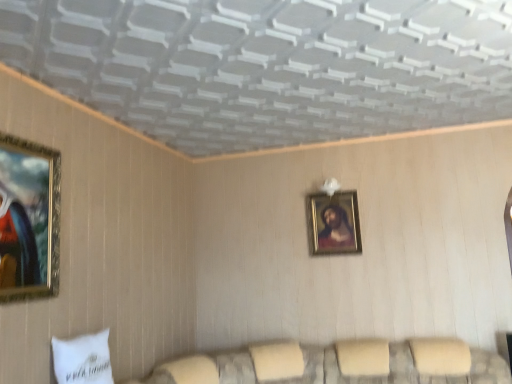
What do you see at coordinates (82, 359) in the screenshot? Image resolution: width=512 pixels, height=384 pixels. I see `white fabric pillow at lower left` at bounding box center [82, 359].

This screenshot has width=512, height=384. What do you see at coordinates (29, 219) in the screenshot?
I see `gold-framed painting at left, which appears as the 2th picture frame when viewed from the right` at bounding box center [29, 219].

At what (x,y) coordinates should I click in order to perform the action: click on white fabric pillow at lower left. Please return your answer as a coordinate pair (x, y). Looking at the image, I should click on (82, 359).

Is white fabric pillow at lower left surrounded by gold-framed portrait at center, which ranks as the second picture frame in left-to-right order?

No, white fabric pillow at lower left is not a part of gold-framed portrait at center, which ranks as the second picture frame in left-to-right order.

Considering the relative sizes of gold-framed portrait at center, the first picture frame in the back-to-front sequence, and white fabric pillow at lower left in the image provided, is gold-framed portrait at center, the first picture frame in the back-to-front sequence, bigger than white fabric pillow at lower left?

Incorrect, gold-framed portrait at center, the first picture frame in the back-to-front sequence, is not larger than white fabric pillow at lower left.

Which object is closer to the camera, gold-framed portrait at center, the first picture frame when ordered from right to left, or white fabric pillow at lower left?

white fabric pillow at lower left is more forward.

Which object is further away from the camera taking this photo, gold-framed portrait at center, the first picture frame in the back-to-front sequence, or gold-framed painting at left, arranged as the 1th picture frame when viewed from the front?

Positioned behind is gold-framed portrait at center, the first picture frame in the back-to-front sequence.

Does gold-framed portrait at center, the first picture frame in the back-to-front sequence, turn towards gold-framed painting at left, arranged as the 1th picture frame when viewed from the front?

No.

Who is taller, gold-framed portrait at center, the first picture frame in the back-to-front sequence, or gold-framed painting at left, the 2th picture frame positioned from the back?

Standing taller between the two is gold-framed painting at left, the 2th picture frame positioned from the back.

Is gold-framed painting at left, the 1th picture frame when ordered from left to right, facing away from velvet beige couch at lower center?

No, gold-framed painting at left, the 1th picture frame when ordered from left to right,'s orientation is not away from velvet beige couch at lower center.

What are the coordinates of `picture frame on the left of velvet beige couch at lower center` in the screenshot? It's located at (29, 219).

Does point (7, 239) come closer to viewer compared to point (508, 371)?

Yes.

From their relative heights in the image, would you say gold-framed painting at left, the 1th picture frame when ordered from left to right, is taller or shorter than velvet beige couch at lower center?

Considering their sizes, gold-framed painting at left, the 1th picture frame when ordered from left to right, has more height than velvet beige couch at lower center.

From the image's perspective, which is below, gold-framed portrait at center, marked as the 2th picture frame in a front-to-back arrangement, or velvet beige couch at lower center?

From the image's view, velvet beige couch at lower center is below.

From a real-world perspective, is gold-framed portrait at center, which ranks as the second picture frame in left-to-right order, on top of velvet beige couch at lower center?

Yes.

You are a GUI agent. You are given a task and a screenshot of the screen. Output one action in this format:
    pyautogui.click(x=<x>, y=<y>)
    Task: Click on the couch in front of the gold-framed portrait at center, the first picture frame when ordered from right to left
    The image size is (512, 384).
    Given the screenshot: What is the action you would take?
    pyautogui.click(x=343, y=364)

Is gold-framed portrait at center, which ranks as the second picture frame in left-to-right order, in contact with velvet beige couch at lower center?

No.

Can you confirm if white fabric pillow at lower left is positioned to the right of gold-framed portrait at center, the first picture frame in the back-to-front sequence?

No.

Consider the image. From a real-world perspective, does white fabric pillow at lower left sit lower than gold-framed portrait at center, the first picture frame in the back-to-front sequence?

Yes, from a real-world perspective, white fabric pillow at lower left is under gold-framed portrait at center, the first picture frame in the back-to-front sequence.

Considering the sizes of objects white fabric pillow at lower left and gold-framed portrait at center, which ranks as the second picture frame in left-to-right order, in the image provided, who is bigger, white fabric pillow at lower left or gold-framed portrait at center, which ranks as the second picture frame in left-to-right order,?

Bigger between the two is white fabric pillow at lower left.

From the picture: Is white fabric pillow at lower left facing towards gold-framed portrait at center, which ranks as the second picture frame in left-to-right order?

No, white fabric pillow at lower left does not turn towards gold-framed portrait at center, which ranks as the second picture frame in left-to-right order.

Is white fabric pillow at lower left thinner than velvet beige couch at lower center?

Yes, white fabric pillow at lower left is thinner than velvet beige couch at lower center.

Is white fabric pillow at lower left positioned in front of velvet beige couch at lower center?

Yes.

Does white fabric pillow at lower left appear on the left side of velvet beige couch at lower center?

Correct, you'll find white fabric pillow at lower left to the left of velvet beige couch at lower center.

From the image's perspective, between white fabric pillow at lower left and velvet beige couch at lower center, who is located below?

From the image's view, velvet beige couch at lower center is below.

Would you say velvet beige couch at lower center is to the left or to the right of white fabric pillow at lower left in the picture?

velvet beige couch at lower center is positioned on white fabric pillow at lower left's right side.

Considering the sizes of velvet beige couch at lower center and white fabric pillow at lower left in the image, is velvet beige couch at lower center wider or thinner than white fabric pillow at lower left?

Clearly, velvet beige couch at lower center has more width compared to white fabric pillow at lower left.

From the image's perspective, is velvet beige couch at lower center beneath white fabric pillow at lower left?

Correct, velvet beige couch at lower center appears lower than white fabric pillow at lower left in the image.

Choose the correct answer: Is velvet beige couch at lower center inside white fabric pillow at lower left or outside it?

velvet beige couch at lower center exists outside the volume of white fabric pillow at lower left.

This screenshot has height=384, width=512. I want to click on the 1st picture frame above the white fabric pillow at lower left (from the image's perspective), so click(x=334, y=223).

This screenshot has height=384, width=512. In order to click on picture frame that is above the gold-framed painting at left, the 2th picture frame positioned from the back (from a real-world perspective) in this screenshot , I will do `click(334, 223)`.

Looking at the image, which one is located further to velvet beige couch at lower center, gold-framed portrait at center, which ranks as the second picture frame in left-to-right order, or gold-framed painting at left, the 2th picture frame positioned from the back?

Among the two, gold-framed painting at left, the 2th picture frame positioned from the back, is located further to velvet beige couch at lower center.

When comparing their distances from gold-framed portrait at center, the first picture frame when ordered from right to left, does velvet beige couch at lower center or gold-framed painting at left, the 1th picture frame when ordered from left to right, seem further?

Among the two, gold-framed painting at left, the 1th picture frame when ordered from left to right, is located further to gold-framed portrait at center, the first picture frame when ordered from right to left.

Looking at the image, which one is located further to white fabric pillow at lower left, gold-framed painting at left, the 2th picture frame positioned from the back, or gold-framed portrait at center, the first picture frame when ordered from right to left?

The object further to white fabric pillow at lower left is gold-framed portrait at center, the first picture frame when ordered from right to left.

When comparing their distances from gold-framed painting at left, which appears as the 2th picture frame when viewed from the right, does velvet beige couch at lower center or white fabric pillow at lower left seem closer?

Among the two, white fabric pillow at lower left is located nearer to gold-framed painting at left, which appears as the 2th picture frame when viewed from the right.

Looking at the image, which one is located further to gold-framed portrait at center, the first picture frame in the back-to-front sequence, velvet beige couch at lower center or white fabric pillow at lower left?

white fabric pillow at lower left.

Looking at the image, which one is located closer to gold-framed painting at left, arranged as the 1th picture frame when viewed from the front, gold-framed portrait at center, the first picture frame in the back-to-front sequence, or white fabric pillow at lower left?

white fabric pillow at lower left.

Based on their spatial positions, is white fabric pillow at lower left or velvet beige couch at lower center further from gold-framed painting at left, the 2th picture frame positioned from the back?

The object further to gold-framed painting at left, the 2th picture frame positioned from the back, is velvet beige couch at lower center.

When comparing their distances from white fabric pillow at lower left, does gold-framed painting at left, the 2th picture frame positioned from the back, or velvet beige couch at lower center seem further?

velvet beige couch at lower center is positioned further to the anchor white fabric pillow at lower left.

At what (x,y) coordinates should I click in order to perform the action: click on couch between white fabric pillow at lower left and gold-framed portrait at center, the first picture frame when ordered from right to left, along the z-axis. Please return your answer as a coordinate pair (x, y). Looking at the image, I should click on (343, 364).

Identify the location of pillow between gold-framed painting at left, arranged as the 1th picture frame when viewed from the front, and gold-framed portrait at center, the first picture frame in the back-to-front sequence, in the front-back direction. [82, 359].

Where is `couch situated between gold-framed painting at left, arranged as the 1th picture frame when viewed from the front, and gold-framed portrait at center, the first picture frame when ordered from right to left, from left to right`? couch situated between gold-framed painting at left, arranged as the 1th picture frame when viewed from the front, and gold-framed portrait at center, the first picture frame when ordered from right to left, from left to right is located at coordinates (343, 364).

Locate an element on the screen. This screenshot has height=384, width=512. pillow between gold-framed painting at left, the 2th picture frame positioned from the back, and velvet beige couch at lower center, in the horizontal direction is located at coordinates (82, 359).